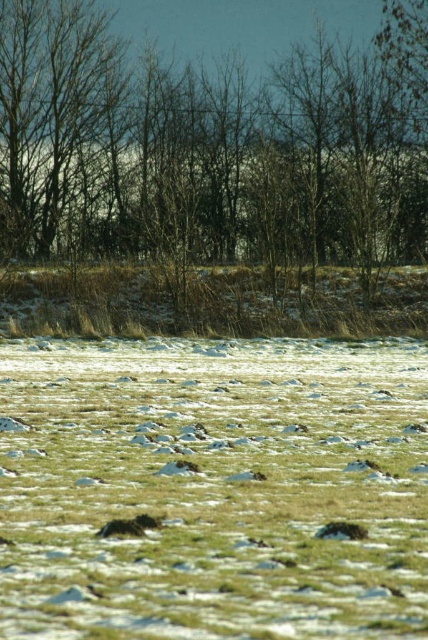
Question: Observing the image, what is the correct spatial positioning of brown leafless tree at center in reference to dry grass at center?

Choices:
 (A) left
 (B) right

Answer: (B)

Question: Does brown leafless tree at center appear on the left side of dry grass at center?

Choices:
 (A) no
 (B) yes

Answer: (A)

Question: From the image, what is the correct spatial relationship of brown leafless tree at center in relation to dry grass at center?

Choices:
 (A) above
 (B) below

Answer: (A)

Question: Which of the following is the closest to the observer?

Choices:
 (A) brown leafless tree at center
 (B) dry grass at center

Answer: (B)